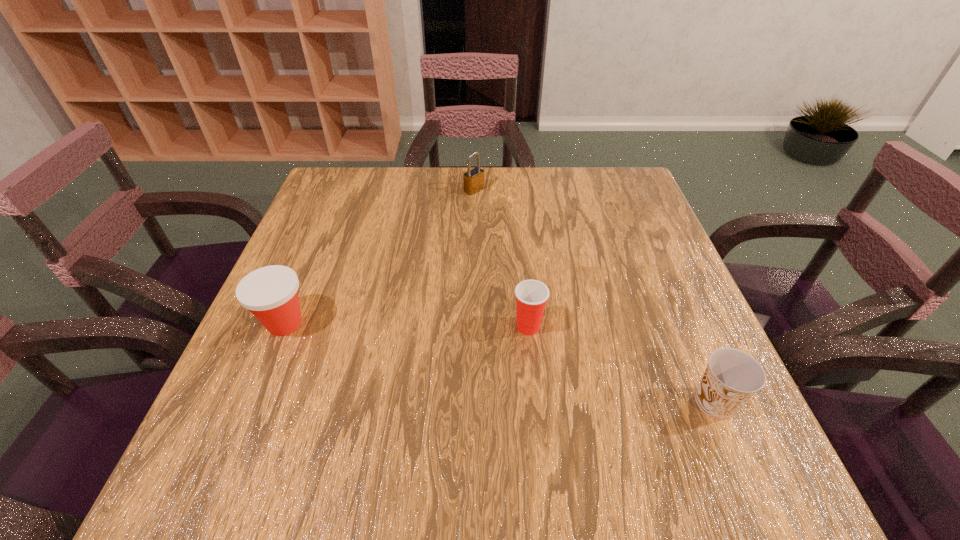
This screenshot has width=960, height=540. What are the coordinates of `free space between the second Dixie cup from right to left and the rightmost Dixie cup` in the screenshot? It's located at (621, 364).

Locate an element on the screen. The width and height of the screenshot is (960, 540). free space that is in between the second Dixie cup from left to right and the leftmost Dixie cup is located at coordinates (406, 325).

You are a GUI agent. You are given a task and a screenshot of the screen. Output one action in this format:
    pyautogui.click(x=<x>, y=<y>)
    Task: Click on the vacant space that is in between the farthest object and the leftmost object
    
    Given the screenshot: What is the action you would take?
    pyautogui.click(x=379, y=256)

The width and height of the screenshot is (960, 540). Identify the location of free space between the leftmost Dixie cup and the padlock. (379, 256).

What are the coordinates of `free space that is in between the rightmost object and the third object from right to left` in the screenshot? It's located at (594, 296).

Where is `vacant region between the rightmost object and the second object from right to left`? The width and height of the screenshot is (960, 540). vacant region between the rightmost object and the second object from right to left is located at coordinates [621, 364].

At what (x,y) coordinates should I click in order to perform the action: click on vacant area that lies between the padlock and the rightmost Dixie cup. Please return your answer as a coordinate pair (x, y). The image size is (960, 540). Looking at the image, I should click on (594, 296).

The width and height of the screenshot is (960, 540). I want to click on vacant region between the nearest Dixie cup and the farthest object, so click(x=594, y=296).

Identify which object is located as the second nearest to the leftmost Dixie cup. Please provide its 2D coordinates. Your answer should be formatted as a tuple, i.e. [(x, y)], where the tuple contains the x and y coordinates of a point satisfying the conditions above.

[(473, 180)]

You are a GUI agent. You are given a task and a screenshot of the screen. Output one action in this format:
    pyautogui.click(x=<x>, y=<y>)
    Task: Click on the third closest object relative to the third object from left to right
    This screenshot has height=540, width=960.
    Given the screenshot: What is the action you would take?
    pyautogui.click(x=473, y=180)